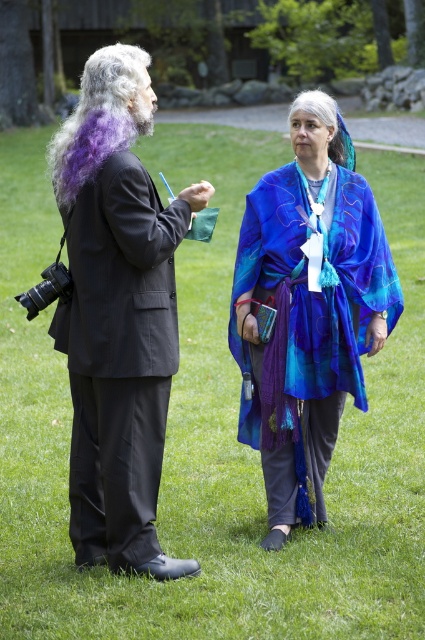
Can you confirm if purple silky hair at left is positioned above gray/blue fabric at center?

Actually, purple silky hair at left is below gray/blue fabric at center.

You are a GUI agent. You are given a task and a screenshot of the screen. Output one action in this format:
    pyautogui.click(x=<x>, y=<y>)
    Task: Click on the purple silky hair at left
    The height and width of the screenshot is (640, 425).
    Given the screenshot: What is the action you would take?
    pyautogui.click(x=101, y=118)

I want to click on purple silky hair at left, so click(x=101, y=118).

Does matte black suit at left lie behind purple silky hair at left?

No.

Is matte black suit at left thinner than purple silky hair at left?

Correct, matte black suit at left's width is less than purple silky hair at left's.

What do you see at coordinates (118, 314) in the screenshot? This screenshot has height=640, width=425. I see `matte black suit at left` at bounding box center [118, 314].

Find the location of a particular element. This screenshot has height=640, width=425. matte black suit at left is located at coordinates (118, 314).

Does blue silk scarf at center have a greater width compared to purple silky hair at left?

No, blue silk scarf at center is not wider than purple silky hair at left.

Does blue silk scarf at center appear on the left side of purple silky hair at left?

No, blue silk scarf at center is not to the left of purple silky hair at left.

The image size is (425, 640). I want to click on blue silk scarf at center, so click(306, 310).

Image resolution: width=425 pixels, height=640 pixels. Find the location of `blue silk scarf at center`. blue silk scarf at center is located at coordinates (306, 310).